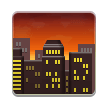
This screenshot has height=108, width=108. What are the coordinates of `yellow windows horizontal` in the screenshot? It's located at (16, 61), (18, 64), (17, 69), (18, 73), (18, 77), (18, 81), (19, 88), (18, 85).